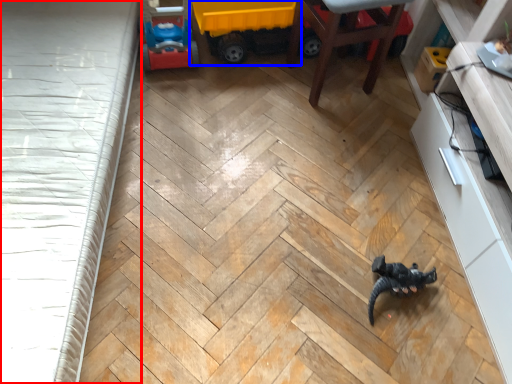
Question: Which object appears farthest to the camera in this image, bed frame (highlighted by a red box) or toy (highlighted by a blue box)?

Choices:
 (A) bed frame
 (B) toy

Answer: (B)